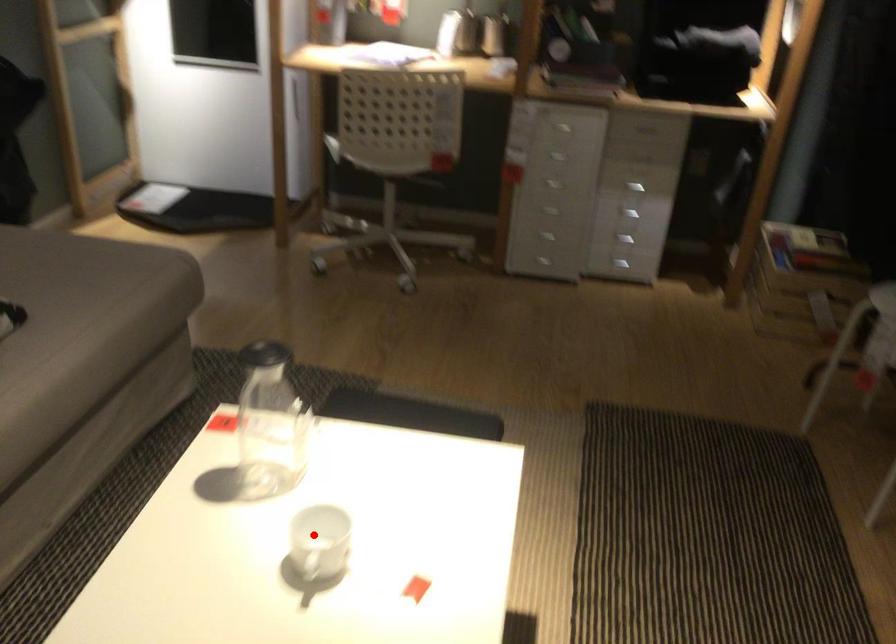
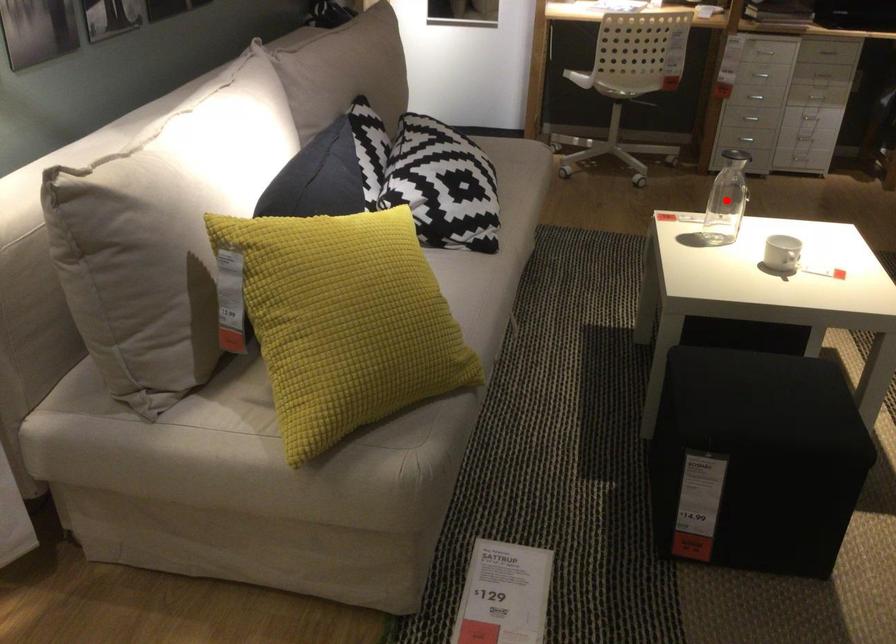
I am providing you with two images of the same scene from different viewpoints. A red point is marked on the first image and another point is marked on the second image. Are the points marked in image1 and image2 representing the same 3D position?

No